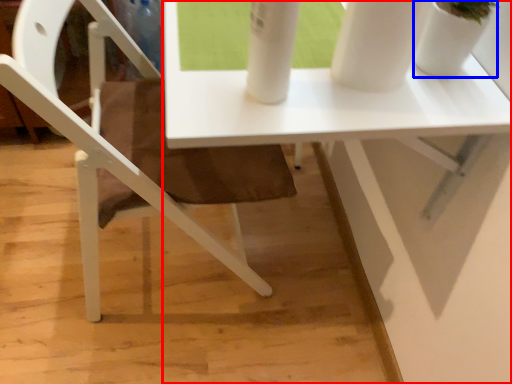
Question: Which point is closer to the camera, table (highlighted by a red box) or glass vase (highlighted by a blue box)?

Choices:
 (A) table
 (B) glass vase

Answer: (B)